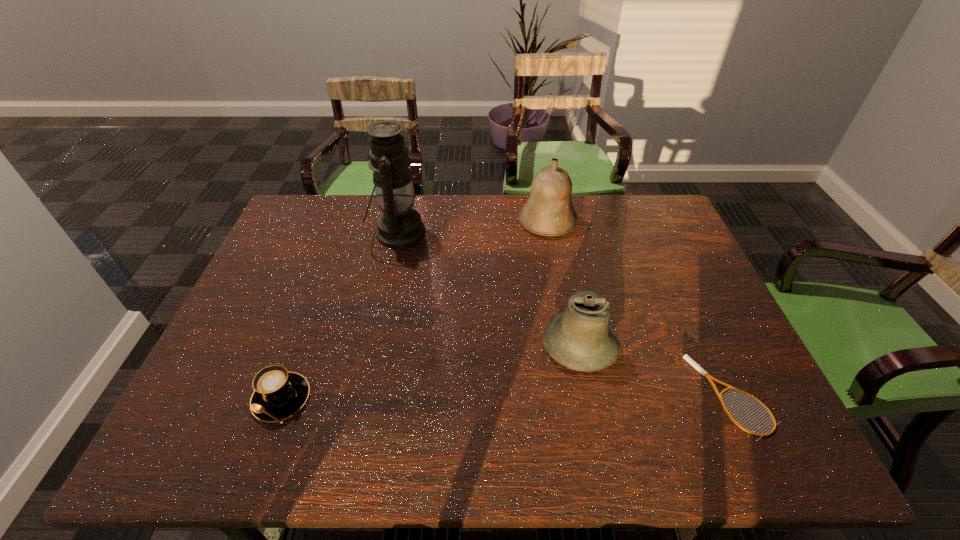
The image size is (960, 540). I want to click on oil lamp, so click(399, 226).

Identify the location of the tallest object. (399, 226).

The width and height of the screenshot is (960, 540). Identify the location of the second tallest object. tap(548, 211).

Where is `the taller bell`? This screenshot has height=540, width=960. the taller bell is located at coordinates (548, 211).

Where is `the nearer bell`? the nearer bell is located at coordinates (581, 338).

Find the location of `the shorter bell`. the shorter bell is located at coordinates point(581,338).

Find the location of `cappuccino`. cappuccino is located at coordinates (278, 394).

Image resolution: width=960 pixels, height=540 pixels. What are the coordinates of `the fourth tallest object` in the screenshot? It's located at (278, 394).

Where is `the rightmost object`? the rightmost object is located at coordinates (686, 357).

The width and height of the screenshot is (960, 540). What are the coordinates of `the shortest object` in the screenshot? It's located at (686, 357).